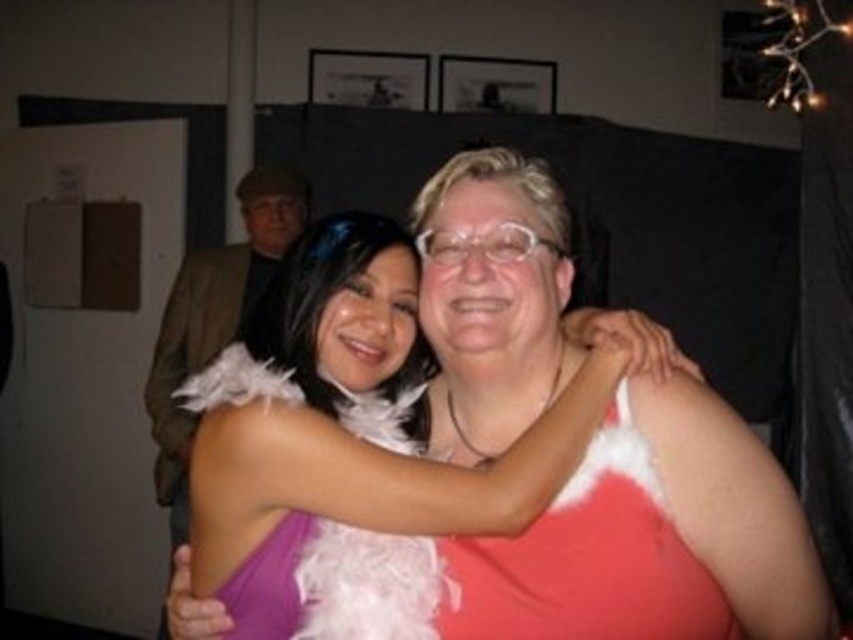
Question: Considering the relative positions of white feather boa at center and purple feathered dress at center in the image provided, where is white feather boa at center located with respect to purple feathered dress at center?

Choices:
 (A) below
 (B) above

Answer: (B)

Question: From the image, what is the correct spatial relationship of white feather boa at center in relation to brown woolen jacket at upper left?

Choices:
 (A) above
 (B) below

Answer: (B)

Question: Which point appears farthest from the camera in this image?

Choices:
 (A) (262, 198)
 (B) (457, 544)
 (C) (521, 545)

Answer: (A)

Question: Can you confirm if white feather boa at center is wider than brown woolen jacket at upper left?

Choices:
 (A) yes
 (B) no

Answer: (B)

Question: Which of the following is the farthest from the observer?

Choices:
 (A) (247, 246)
 (B) (637, 632)

Answer: (A)

Question: Which of the following is the farthest from the observer?

Choices:
 (A) white feather boa at center
 (B) brown woolen jacket at upper left
 (C) purple feathered dress at center

Answer: (B)